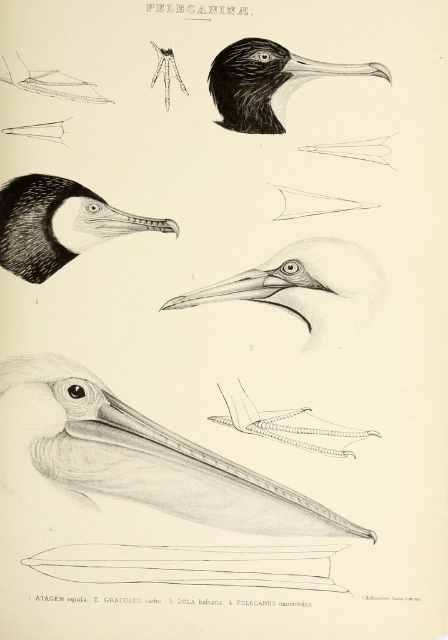
Does white matte pelican beak at lower left have a lesser height compared to black glossy pelican head at upper center?

Incorrect, white matte pelican beak at lower left's height does not fall short of black glossy pelican head at upper center's.

Who is taller, white matte pelican beak at lower left or black glossy pelican head at upper center?

white matte pelican beak at lower left is taller.

Which is in front, point (147, 438) or point (366, 68)?

Positioned in front is point (366, 68).

What are the coordinates of `white matte pelican beak at lower left` in the screenshot? It's located at click(x=158, y=461).

Find the location of a particular element. black glossy pelican head at upper center is located at coordinates (267, 83).

Who is lower down, black glossy pelican head at upper center or black glossy beak at upper center?

black glossy pelican head at upper center is below.

Image resolution: width=448 pixels, height=640 pixels. In order to click on black glossy pelican head at upper center in this screenshot , I will do `click(267, 83)`.

This screenshot has height=640, width=448. What do you see at coordinates (158, 461) in the screenshot?
I see `white matte pelican beak at lower left` at bounding box center [158, 461].

Can you confirm if white matte pelican beak at lower left is positioned below black matte bird head at upper left?

Yes, white matte pelican beak at lower left is below black matte bird head at upper left.

Is point (46, 456) behind point (42, 260)?

No.

The image size is (448, 640). Identify the location of white matte pelican beak at lower left. (158, 461).